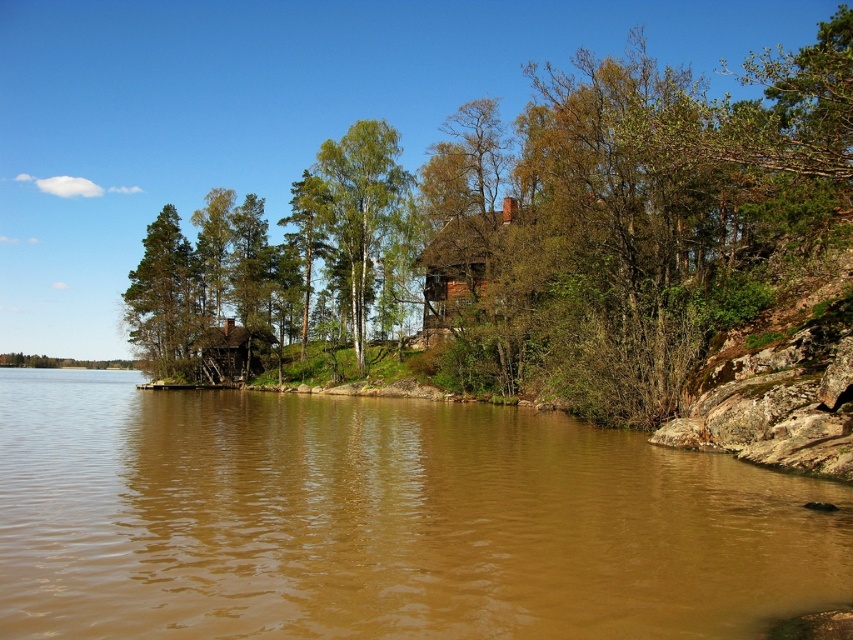
You are standing at the lakeside and want to walk to the cabin. There are two points marked on the path leading to the cabin. One is at point coordinates point [537,321] and the other at point coordinates point [407,182]. Which point should you reach first while walking towards the cabin?

Point [537,321] is closer to the viewer than point [407,182], so you should reach point [537,321] first while walking towards the cabin.

You are an environmental scientist assessing the biodiversity of this lakeside area. You observe the green leafy tree at center and the green matte tree at center. Which tree has a greater width, and what might this indicate about their ecological roles?

The green leafy tree at center has a greater width than the green matte tree at center. This could suggest that the green leafy tree is older, more established, or has access to better resources, potentially making it a keystone species in the ecosystem by providing more shade, habitat, or nutrients compared to the narrower green matte tree at center.

You are standing at the lakeside and want to take a photo of both the green leafy tree at center and the green matte tree at upper left. Which tree should you focus on first to ensure both are in sharp focus?

You should focus on the green leafy tree at center first because it is closer to you than the green matte tree at upper left, so adjusting focus from near to far will help both be in sharp focus.